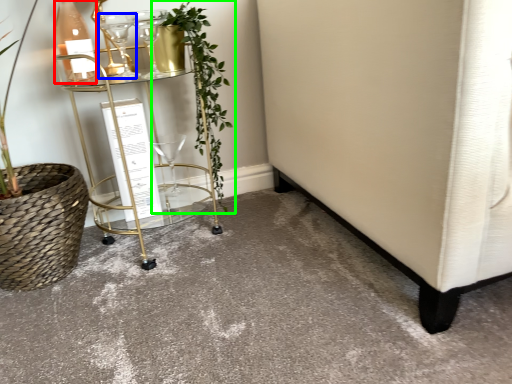
Question: Based on their relative distances, which object is nearer to bottle (highlighted by a red box)? Choose from wine glass (highlighted by a blue box) and houseplant (highlighted by a green box).

Choices:
 (A) wine glass
 (B) houseplant

Answer: (A)